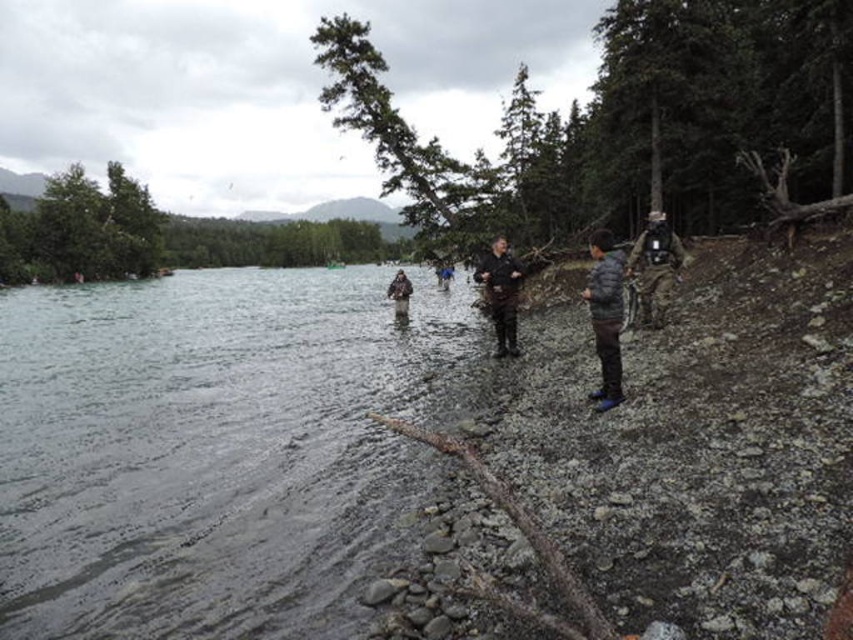
You are a hiker who wants to cross the river using the path near the smooth gray water at lower left and the camouflage jacket at center. Which object would you encounter first if you walk straight towards the river from your current position?

The camouflage jacket at center is closer to you than the smooth gray water at lower left, so you would encounter the camouflage jacket at center first.

You are standing at the center of the image and want to reach the smooth gray water at lower left. Which direction should you move to get there?

Since the smooth gray water at lower left is located at point 0.703 on the x axis and 0.249 on the y axis, you should move to the left and downward from your current position at the center to reach it.

From the picture: You are standing at the riverbank and see both the gray fuzzy jacket at lower right and the camouflage fabric jacket at right. If you want to reach the closest jacket first, which one should you head towards?

The gray fuzzy jacket at lower right is 19.16 meters away from the camouflage fabric jacket at right, so the camouflage fabric jacket at right is closer to you. Therefore, you should head towards the camouflage fabric jacket at right first.